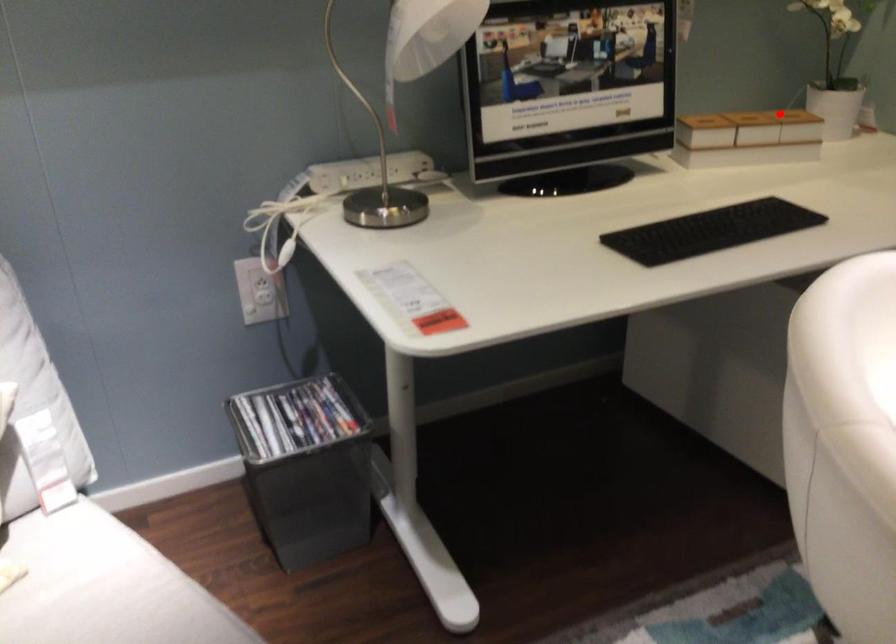
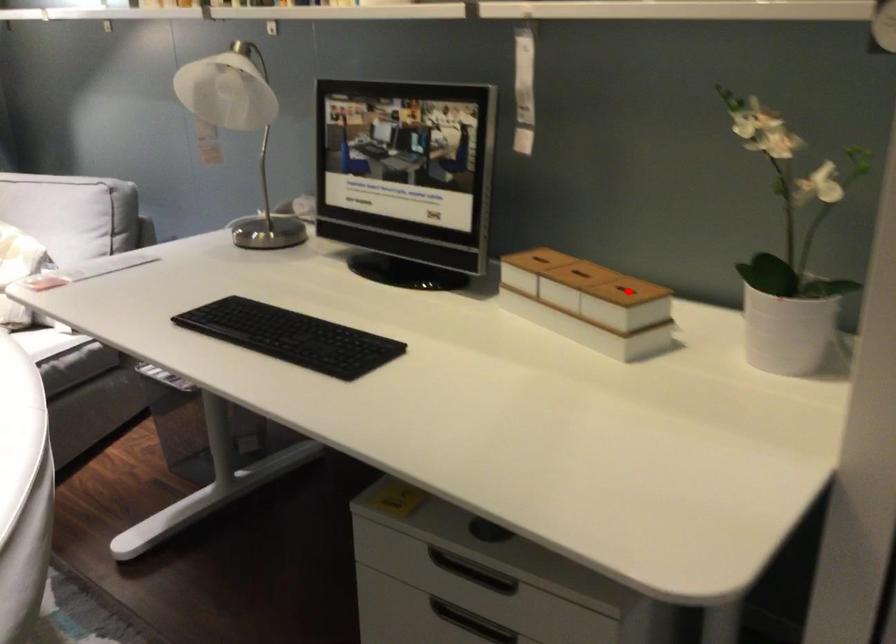
I am providing you with two images of the same scene from different viewpoints. A red point is marked on the first image and another point is marked on the second image. Do the highlighted points in image1 and image2 indicate the same real-world spot?

No